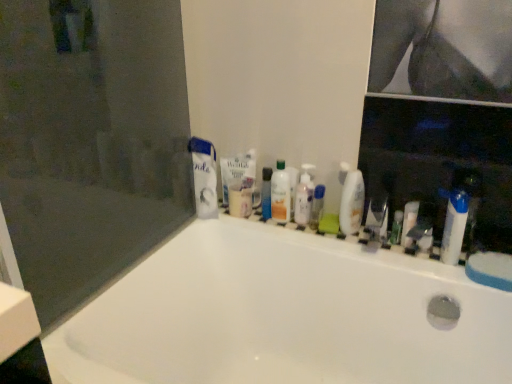
Image resolution: width=512 pixels, height=384 pixels. Identify the location of free space above white glossy ledge at upper center (from a real-world perspective). (342, 231).